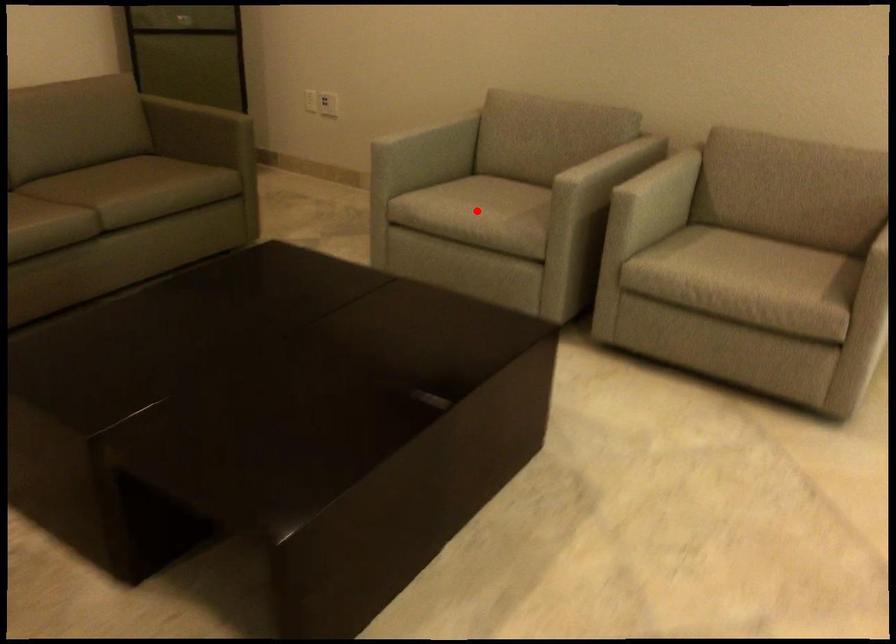
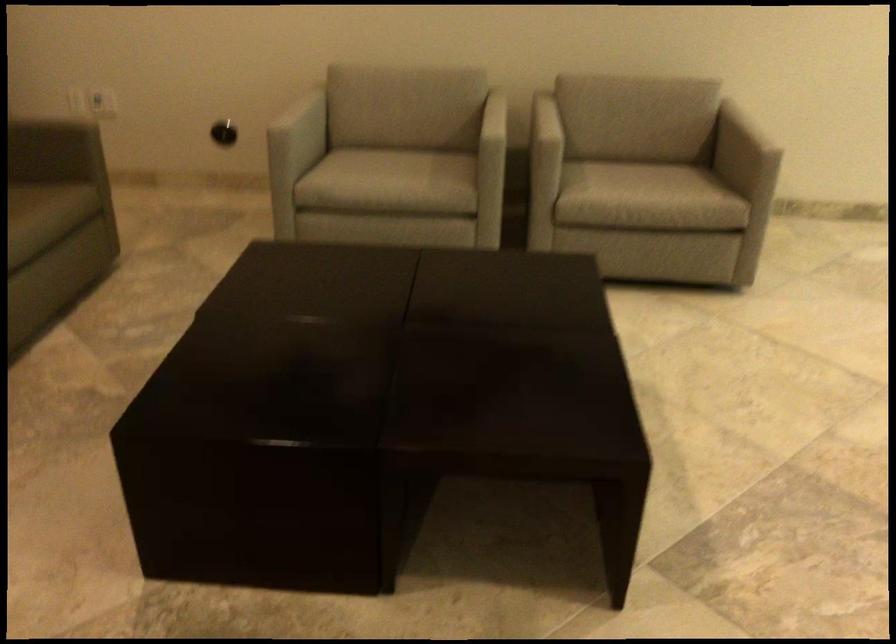
In the second image, find the point that corresponds to the highlighted location in the first image.

(390, 176)